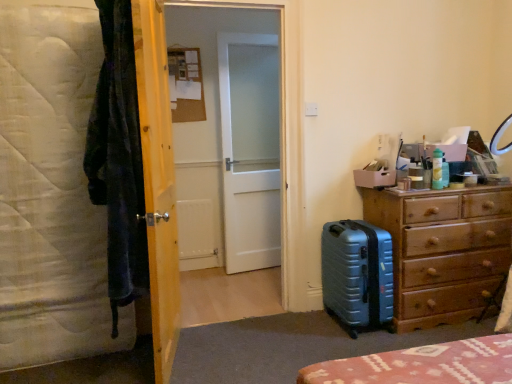
Question: Considering the relative positions of white quilted mattress at left and green plastic bottle at upper right in the image provided, is white quilted mattress at left to the left or to the right of green plastic bottle at upper right?

Choices:
 (A) left
 (B) right

Answer: (A)

Question: From the image's perspective, is white quilted mattress at left above or below green plastic bottle at upper right?

Choices:
 (A) below
 (B) above

Answer: (A)

Question: Which object is the farthest from the wooden dresser at right?

Choices:
 (A) white frosted glass door at center, marked as the 1th screen door in a front-to-back arrangement
 (B) wooden door at center
 (C) white matte screen door at center, the second screen door viewed from the front
 (D) metallic blue suitcase at lower right
 (E) matte plastic cup at right

Answer: (C)

Question: Estimate the real-world distances between objects in this image. Which object is closer to the white matte screen door at center, which is the first screen door from back to front?

Choices:
 (A) green plastic bottle at upper right
 (B) white cardboard box at right
 (C) white quilted mattress at left
 (D) wooden dresser at right
 (E) matte plastic cup at right

Answer: (B)